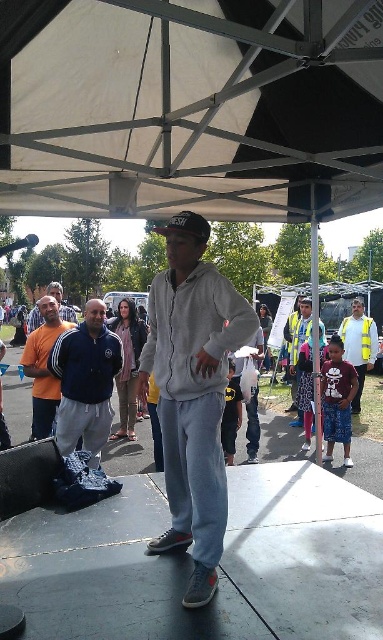
You are organizing a safety briefing for participants at this event. You need to ensure that all attendees can see the emergency exit signs clearly. The emergency exit signs are placed at the highest point of the canopy. Which object among the blue fleece jacket at center and the reflective yellow vest at center is more likely to block the view of the signs?

The blue fleece jacket at center is bigger than the reflective yellow vest at center, so it is more likely to block the view of the emergency exit signs placed at the highest point of the canopy.

You are a visitor at the event and want to know if the white fabric canopy at upper center can provide shade for the light gray fleece hoodie at center. Based on their heights, can it do so?

The white fabric canopy at upper center is not as tall as the light gray fleece hoodie at center, so it cannot provide adequate shade for the light gray fleece hoodie at center.

Based on the scene description, can you determine which object is bigger between the white fabric canopy at upper center and the light gray fleece hoodie at center?

The white fabric canopy at upper center is larger in size than the light gray fleece hoodie at center.